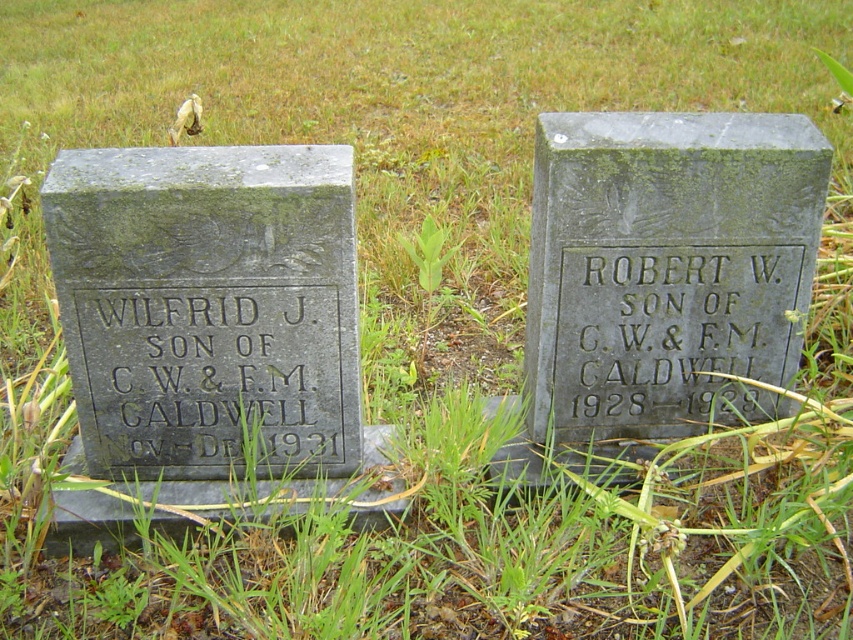
In the scene shown: Is gray stone gravestone at right wider than black granite gravestone at center right?

Indeed, gray stone gravestone at right has a greater width compared to black granite gravestone at center right.

Which is in front, point (549, 340) or point (636, 356)?

Point (549, 340) is in front.

What do you see at coordinates (666, 268) in the screenshot? I see `gray stone gravestone at right` at bounding box center [666, 268].

Locate an element on the screen. gray stone gravestone at right is located at coordinates (666, 268).

Is gray stone gravestone at right positioned in front of black stone gravestone at left?

Yes, gray stone gravestone at right is closer to the viewer.

Can you confirm if gray stone gravestone at right is thinner than black stone gravestone at left?

No, gray stone gravestone at right is not thinner than black stone gravestone at left.

I want to click on gray stone gravestone at right, so click(666, 268).

Does black stone gravestone at left have a smaller size compared to black granite gravestone at center right?

Correct, black stone gravestone at left occupies less space than black granite gravestone at center right.

Between black stone gravestone at left and black granite gravestone at center right, which one has less height?

black stone gravestone at left is shorter.

At what (x,y) coordinates should I click in order to perform the action: click on black stone gravestone at left. Please return your answer as a coordinate pair (x, y). The height and width of the screenshot is (640, 853). Looking at the image, I should click on (213, 372).